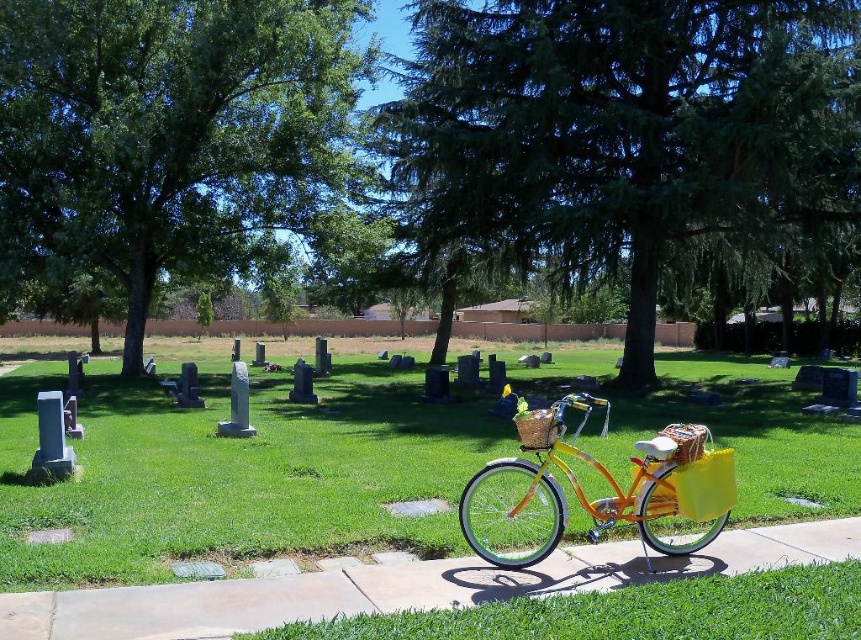
Who is positioned more to the right, yellow matte bicycle at center or yellow woven basket at center?

yellow woven basket at center

Can you confirm if yellow matte bicycle at center is thinner than yellow woven basket at center?

Incorrect, yellow matte bicycle at center's width is not less than yellow woven basket at center's.

Does point (552, 499) come closer to viewer compared to point (697, 440)?

Yes.

Locate an element on the screen. yellow matte bicycle at center is located at coordinates (596, 499).

Based on the photo, who is positioned more to the right, green leafy tree at upper left or yellow woven basket at center?

Positioned to the right is yellow woven basket at center.

Is green leafy tree at upper left above yellow woven basket at center?

Indeed, green leafy tree at upper left is positioned over yellow woven basket at center.

Between point (242, 51) and point (674, 424), which one is positioned behind?

Point (242, 51)

Locate an element on the screen. This screenshot has width=861, height=640. green leafy tree at upper left is located at coordinates (172, 132).

Does green grass at center have a larger size compared to green leafy tree at upper left?

Actually, green grass at center might be smaller than green leafy tree at upper left.

Does green grass at center appear over green leafy tree at upper left?

Actually, green grass at center is below green leafy tree at upper left.

Describe the element at coordinates (234, 470) in the screenshot. This screenshot has height=640, width=861. I see `green grass at center` at that location.

Find the location of a particular element. This screenshot has height=640, width=861. green grass at center is located at coordinates (234, 470).